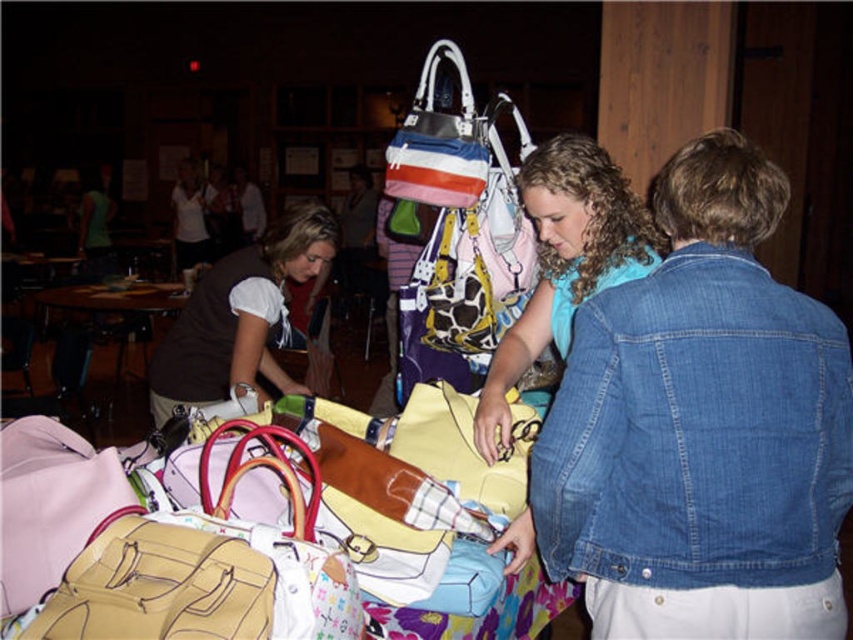
You are a customer at a handbag store and want to pick up the striped canvas tote at center. Can you lift it without moving the wooden round table at center?

The striped canvas tote at center is positioned over wooden round table at center, so you can lift it without moving the table since it is placed on top of it.

In the scene shown: You are at a store and need to pick up the denim jacket at lower right. Which side of the wooden round table at center should you approach from?

You should approach from the right side of the wooden round table at center because the denim jacket at lower right is located to the right of it.

You are a customer at a handbag store and see the matte yellow purse at center and the wooden round table at center. Which object is positioned lower in the image?

The matte yellow purse at center is positioned lower than the wooden round table at center.